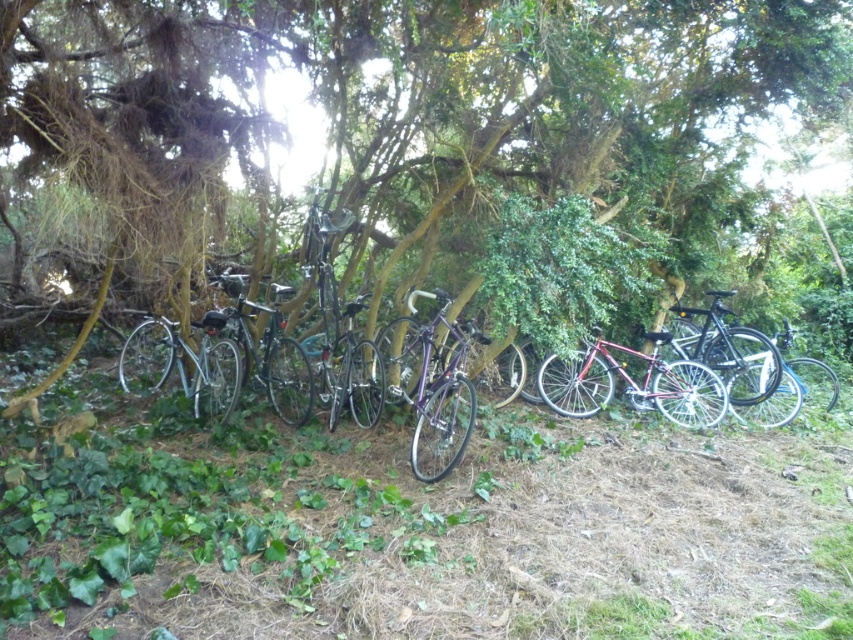
Question: Does green leafy tree at center have a smaller size compared to shiny red bicycle at center?

Choices:
 (A) yes
 (B) no

Answer: (B)

Question: Can you confirm if green leafy tree at center is positioned below shiny red bicycle at center?

Choices:
 (A) yes
 (B) no

Answer: (B)

Question: Considering the real-world distances, which object is closest to the purple metallic bicycle at center?

Choices:
 (A) green leafy tree at center
 (B) shiny black mountain bike at center
 (C) shiny silver bicycle at right

Answer: (B)

Question: Can you confirm if green leafy tree at center is positioned to the left of shiny silver bicycle at right?

Choices:
 (A) yes
 (B) no

Answer: (A)

Question: Among these points, which one is nearest to the camera?

Choices:
 (A) (410, 212)
 (B) (689, 419)
 (C) (163, 340)

Answer: (B)

Question: Which object is positioned farthest from the shiny silver bicycle at right?

Choices:
 (A) purple metallic bicycle at center
 (B) green leafy tree at center
 (C) shiny black bicycle at right

Answer: (A)